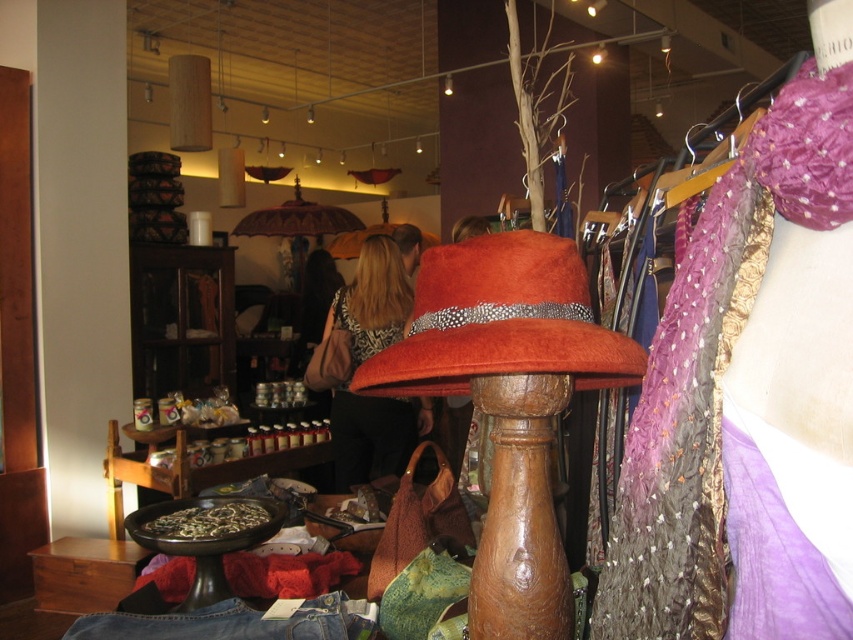
Is point (556, 317) closer to viewer compared to point (346, 312)?

Yes, it is in front of point (346, 312).

The image size is (853, 640). Identify the location of orange felt hat at center. tap(500, 321).